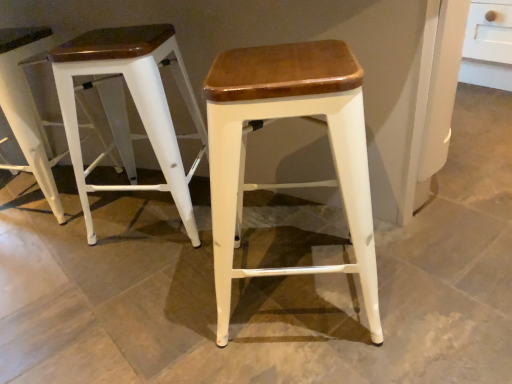
Question: Considering the relative sizes of white matte stool at left, which is counted as the 2th stool, starting from the right, and white wood stool at center, the 1th stool viewed from the right, in the image provided, is white matte stool at left, which is counted as the 2th stool, starting from the right, bigger than white wood stool at center, the 1th stool viewed from the right,?

Choices:
 (A) yes
 (B) no

Answer: (A)

Question: From the image's perspective, is white matte stool at left, which is counted as the second stool, starting from the left, above white wood stool at center, the 1th stool viewed from the right?

Choices:
 (A) yes
 (B) no

Answer: (A)

Question: Considering the relative sizes of white matte stool at left, which is counted as the second stool, starting from the left, and white wood stool at center, the third stool when ordered from left to right, in the image provided, is white matte stool at left, which is counted as the second stool, starting from the left, smaller than white wood stool at center, the third stool when ordered from left to right,?

Choices:
 (A) no
 (B) yes

Answer: (A)

Question: Can you confirm if white matte stool at left, which is counted as the second stool, starting from the left, is shorter than white wood stool at center, the 1th stool viewed from the right?

Choices:
 (A) yes
 (B) no

Answer: (A)

Question: From the image's perspective, is white matte stool at left, which is counted as the second stool, starting from the left, located beneath white wood stool at center, the third stool when ordered from left to right?

Choices:
 (A) no
 (B) yes

Answer: (A)

Question: In terms of size, does white wood stool at center, the third stool when ordered from left to right, appear bigger or smaller than white matte stool at left, which is counted as the second stool, starting from the left?

Choices:
 (A) small
 (B) big

Answer: (A)

Question: Considering their positions, is white wood stool at center, the third stool when ordered from left to right, located in front of or behind white matte stool at left, which is counted as the 2th stool, starting from the right?

Choices:
 (A) front
 (B) behind

Answer: (A)

Question: From the image's perspective, is white wood stool at center, the 1th stool viewed from the right, above or below white matte stool at left, which is counted as the second stool, starting from the left?

Choices:
 (A) above
 (B) below

Answer: (B)

Question: Is white wood stool at center, the 1th stool viewed from the right, wider or thinner than white matte stool at left, which is counted as the second stool, starting from the left?

Choices:
 (A) wide
 (B) thin

Answer: (B)

Question: Is white matte stool at left, which is counted as the second stool, starting from the left, taller or shorter than white matte stool at left, which is the 1th stool from left to right?

Choices:
 (A) short
 (B) tall

Answer: (A)

Question: From a real-world perspective, is white matte stool at left, which is counted as the 2th stool, starting from the right, above or below white matte stool at left, acting as the 3th stool starting from the right?

Choices:
 (A) below
 (B) above

Answer: (A)

Question: From the image's perspective, is white matte stool at left, which is counted as the second stool, starting from the left, above or below white matte stool at left, acting as the 3th stool starting from the right?

Choices:
 (A) above
 (B) below

Answer: (B)

Question: Do you think white matte stool at left, which is counted as the 2th stool, starting from the right, is within white matte stool at left, which is the 1th stool from left to right, or outside of it?

Choices:
 (A) outside
 (B) inside

Answer: (A)

Question: Is white matte stool at left, acting as the 3th stool starting from the right, in front of or behind white matte stool at left, which is counted as the 2th stool, starting from the right, in the image?

Choices:
 (A) front
 (B) behind

Answer: (B)

Question: Would you say white matte stool at left, which is the 1th stool from left to right, is to the left or to the right of white matte stool at left, which is counted as the second stool, starting from the left, in the picture?

Choices:
 (A) right
 (B) left

Answer: (B)